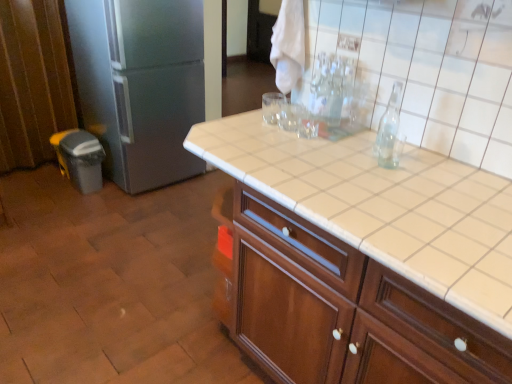
What do you see at coordinates (140, 85) in the screenshot?
I see `satin silver refrigerator at left` at bounding box center [140, 85].

This screenshot has height=384, width=512. In order to click on satin silver refrigerator at left in this screenshot , I will do pos(140,85).

Find the location of a particular element. The width and height of the screenshot is (512, 384). white tile countertop at center is located at coordinates (383, 206).

Describe the element at coordinates (383, 206) in the screenshot. The height and width of the screenshot is (384, 512). I see `white tile countertop at center` at that location.

What is the approximate height of white tile countertop at center?

white tile countertop at center is 1.96 inches in height.

Find the location of a particular element. satin silver refrigerator at left is located at coordinates (140, 85).

Is white tile countertop at center to the left of satin silver refrigerator at left from the viewer's perspective?

No, white tile countertop at center is not to the left of satin silver refrigerator at left.

Considering the positions of objects white tile countertop at center and satin silver refrigerator at left in the image provided, who is in front, white tile countertop at center or satin silver refrigerator at left?

white tile countertop at center.

Between point (484, 186) and point (151, 39), which one is positioned in front?

The point (484, 186) is more forward.

Based on the photo, from the image's perspective, is white tile countertop at center positioned above or below satin silver refrigerator at left?

white tile countertop at center is situated lower than satin silver refrigerator at left in the image.

From a real-world perspective, is white tile countertop at center positioned above or below satin silver refrigerator at left?

Clearly, from a real-world perspective, white tile countertop at center is above satin silver refrigerator at left.

Does white tile countertop at center have a lesser width compared to satin silver refrigerator at left?

Indeed, white tile countertop at center has a lesser width compared to satin silver refrigerator at left.

In terms of height, does white tile countertop at center look taller or shorter compared to satin silver refrigerator at left?

Clearly, white tile countertop at center is shorter compared to satin silver refrigerator at left.

Considering the relative sizes of white tile countertop at center and satin silver refrigerator at left in the image provided, is white tile countertop at center bigger than satin silver refrigerator at left?

No, white tile countertop at center is not bigger than satin silver refrigerator at left.

Which is correct: white tile countertop at center is inside satin silver refrigerator at left, or outside of it?

white tile countertop at center is spatially situated outside satin silver refrigerator at left.

Based on the photo, is white tile countertop at center positioned far away from satin silver refrigerator at left?

That's right, there is a large distance between white tile countertop at center and satin silver refrigerator at left.

Is white tile countertop at center facing away from satin silver refrigerator at left?

No, satin silver refrigerator at left is not at the back of white tile countertop at center.

How different are the orientations of white tile countertop at center and satin silver refrigerator at left in degrees?

The angle between the facing direction of white tile countertop at center and the facing direction of satin silver refrigerator at left is 88.9 degrees.

Where is `table in front of the satin silver refrigerator at left`? table in front of the satin silver refrigerator at left is located at coordinates (383, 206).

Based on the photo, which is more to the right, satin silver refrigerator at left or white tile countertop at center?

white tile countertop at center.

Between satin silver refrigerator at left and white tile countertop at center, which one is positioned behind?

satin silver refrigerator at left.

Considering the positions of point (161, 174) and point (356, 143), is point (161, 174) closer or farther from the camera than point (356, 143)?

Clearly, point (161, 174) is more distant from the camera than point (356, 143).

From the image's perspective, which object appears higher, satin silver refrigerator at left or white tile countertop at center?

satin silver refrigerator at left is shown above in the image.

Consider the image. From a real-world perspective, between satin silver refrigerator at left and white tile countertop at center, who is vertically lower?

satin silver refrigerator at left, from a real-world perspective.

Which object is wider, satin silver refrigerator at left or white tile countertop at center?

satin silver refrigerator at left.

Between satin silver refrigerator at left and white tile countertop at center, which one has more height?

With more height is satin silver refrigerator at left.

In terms of size, does satin silver refrigerator at left appear bigger or smaller than white tile countertop at center?

Considering their sizes, satin silver refrigerator at left takes up more space than white tile countertop at center.

Is satin silver refrigerator at left not within white tile countertop at center?

satin silver refrigerator at left lies outside white tile countertop at center's area.

Is satin silver refrigerator at left with white tile countertop at center?

There is a gap between satin silver refrigerator at left and white tile countertop at center.

Is satin silver refrigerator at left looking in the opposite direction of white tile countertop at center?

No.

What's the angular difference between satin silver refrigerator at left and white tile countertop at center's facing directions?

The angular difference between satin silver refrigerator at left and white tile countertop at center is 88.9 degrees.

Identify the location of table on the right of satin silver refrigerator at left. (383, 206).

Find the location of `refrigerator above the white tile countertop at center (from the image's perspective)`. refrigerator above the white tile countertop at center (from the image's perspective) is located at coordinates (140, 85).

Locate an element on the screen. This screenshot has width=512, height=384. refrigerator that is behind the white tile countertop at center is located at coordinates pyautogui.click(x=140, y=85).